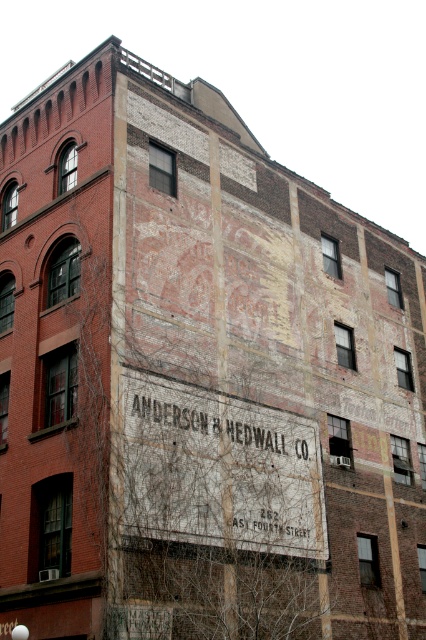
Question: Does white painted sign at center appear on the right side of white faded sign at center?

Choices:
 (A) yes
 (B) no

Answer: (A)

Question: Is white painted sign at center further to camera compared to white faded sign at center?

Choices:
 (A) no
 (B) yes

Answer: (A)

Question: Among these points, which one is farthest from the camera?

Choices:
 (A) (244, 403)
 (B) (134, 408)

Answer: (A)

Question: Is white painted sign at center bigger than white faded sign at center?

Choices:
 (A) yes
 (B) no

Answer: (A)